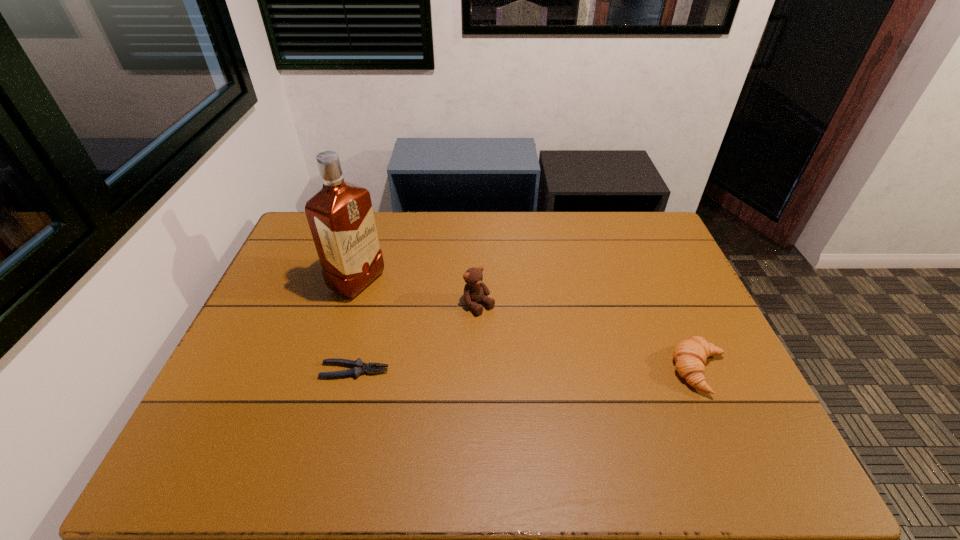
Locate an element on the screen. The height and width of the screenshot is (540, 960). the shortest object is located at coordinates (359, 367).

Find the location of `crescent roll`. crescent roll is located at coordinates (690, 355).

Find the location of a particular element. The image size is (960, 540). the second shortest object is located at coordinates (690, 355).

This screenshot has height=540, width=960. Identify the location of the third shortest object. (475, 291).

At what (x,y) coordinates should I click in order to perform the action: click on teddy bear. Please return your answer as a coordinate pair (x, y). Looking at the image, I should click on (475, 291).

The image size is (960, 540). I want to click on the tallest object, so click(340, 216).

Find the location of a particular element. The image size is (960, 540). free space located 0.380m at the gripping part of the pliers is located at coordinates (536, 370).

Locate an element on the screen. vacant space located 0.150m on the left of the rightmost object is located at coordinates (613, 371).

Find the location of a particular element. The height and width of the screenshot is (540, 960). vacant space situated 0.200m on the face of the third shortest object is located at coordinates (535, 360).

Where is `free spot located 0.130m on the face of the third shortest object`? The width and height of the screenshot is (960, 540). free spot located 0.130m on the face of the third shortest object is located at coordinates (517, 343).